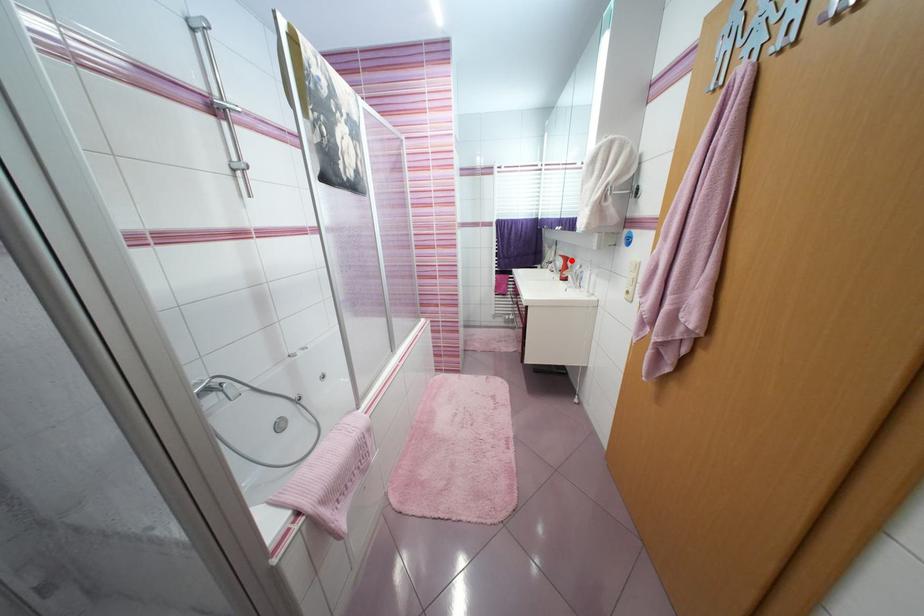
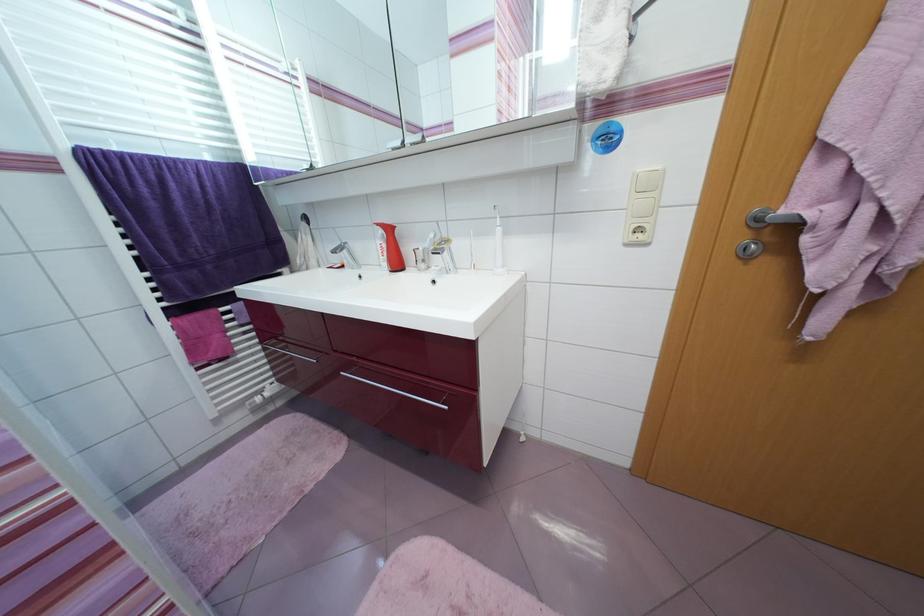
Question: I am providing you with two images of the same scene from different viewpoints. Image1 has a red point marked. In image2, the corresponding 3D location appears at what relative position? Reply with the corresponding letter.

Choices:
 (A) Closer
 (B) Farther

Answer: (B)